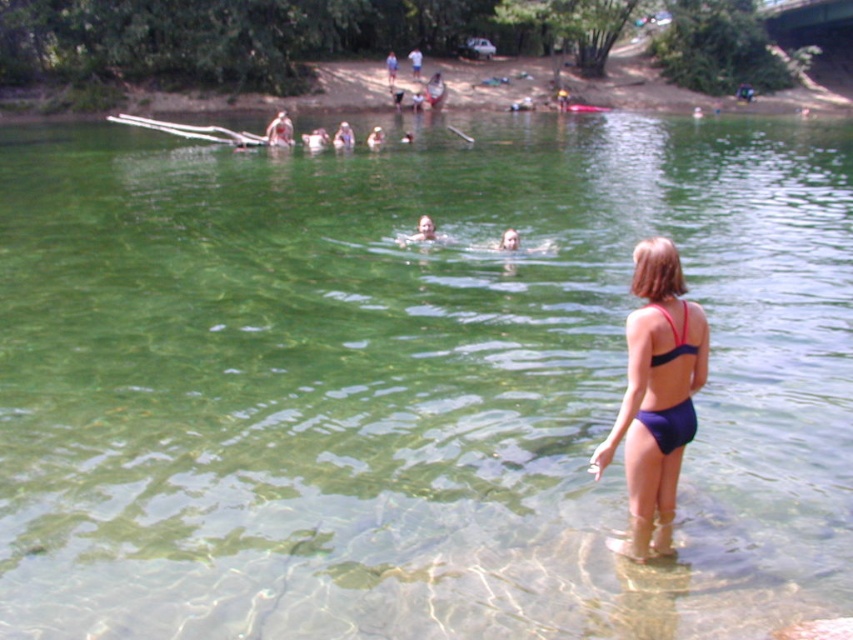
Is purple fabric bikini at right wider than purple matte bikini at lower right?

Yes.

Which is behind, point (664, 333) or point (675, 435)?

Positioned behind is point (675, 435).

Where is `purple fabric bikini at right`? This screenshot has width=853, height=640. purple fabric bikini at right is located at coordinates (656, 394).